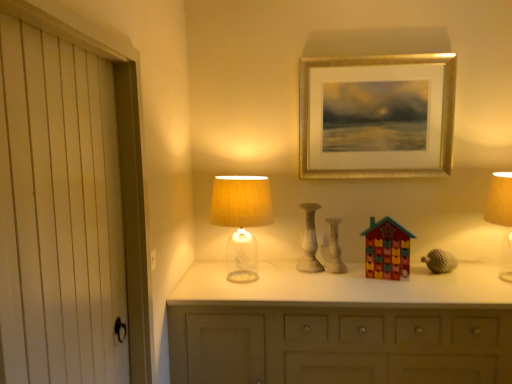
Locate an element on the screen. The width and height of the screenshot is (512, 384). gold metallic picture frame at upper center is located at coordinates (377, 113).

In order to face multicolored plastic advent calendar at center, acting as the first toy starting from the front, should I rotate leftwards or rightwards?

A 17.289 degree turn to the right will do.

Find the location of a particular element. matte ceramic house at center, which ranks as the second toy in right-to-left order is located at coordinates (332, 248).

This screenshot has height=384, width=512. Identify the location of translucent glass lampshade at center, which is the 1th table lamp in left-to-right order. (241, 220).

Describe the element at coordinates (241, 220) in the screenshot. This screenshot has width=512, height=384. I see `translucent glass lampshade at center, which is the 1th table lamp in left-to-right order` at that location.

Locate an element on the screen. white marble candle holder at center is located at coordinates (310, 241).

Locate an element on the screen. The image size is (512, 384). white wood door at left is located at coordinates (120, 165).

From a real-world perspective, which object stands above the other?

From a 3D spatial view, white wood door at left is above.

Image resolution: width=512 pixels, height=384 pixels. In order to click on door on the left of matte yellow fabric lampshade at right, the 1th table lamp positioned from the right in this screenshot , I will do `click(120, 165)`.

How many degrees apart are the facing directions of matte yellow fabric lampshade at right, the second table lamp positioned from the left, and white wood door at left?

The angular difference between matte yellow fabric lampshade at right, the second table lamp positioned from the left, and white wood door at left is 89.7 degrees.

From the image's perspective, between matte yellow fabric lampshade at right, the second table lamp positioned from the left, and white wood door at left, which one is located above?

matte yellow fabric lampshade at right, the second table lamp positioned from the left.

From a real-world perspective, is translucent glass lampshade at center, which is counted as the second table lamp, starting from the right, below multicolored plastic advent calendar at center, acting as the first toy starting from the front?

No, from a real-world perspective, translucent glass lampshade at center, which is counted as the second table lamp, starting from the right, is not under multicolored plastic advent calendar at center, acting as the first toy starting from the front.

Consider the image. Measure the distance from translucent glass lampshade at center, which is counted as the second table lamp, starting from the right, to multicolored plastic advent calendar at center, acting as the first toy starting from the front.

27.79 inches.

In the scene shown: Between translucent glass lampshade at center, which is the 1th table lamp in left-to-right order, and multicolored plastic advent calendar at center, positioned as the 2th toy in left-to-right order, which one has more height?

translucent glass lampshade at center, which is the 1th table lamp in left-to-right order.

Could you tell me if translucent glass lampshade at center, which is counted as the second table lamp, starting from the right, is facing multicolored plastic advent calendar at center, which is counted as the first toy, starting from the right?

No, translucent glass lampshade at center, which is counted as the second table lamp, starting from the right, is not facing towards multicolored plastic advent calendar at center, which is counted as the first toy, starting from the right.

Could gold metallic picture frame at upper center be considered to be inside matte ceramic house at center, placed as the 1th toy when sorted from left to right?

No, gold metallic picture frame at upper center is located outside of matte ceramic house at center, placed as the 1th toy when sorted from left to right.

Considering the sizes of matte ceramic house at center, which ranks as the second toy in right-to-left order, and gold metallic picture frame at upper center in the image, is matte ceramic house at center, which ranks as the second toy in right-to-left order, taller or shorter than gold metallic picture frame at upper center?

In the image, matte ceramic house at center, which ranks as the second toy in right-to-left order, appears to be shorter than gold metallic picture frame at upper center.

Would you say white wood door at left is inside or outside matte gray acorn at right?

white wood door at left is spatially situated outside matte gray acorn at right.

Which is less distant, (122, 92) or (438, 259)?

Clearly, point (122, 92) is closer to the camera than point (438, 259).

In the scene shown: Is the surface of white wood door at left in direct contact with matte gray acorn at right?

No, white wood door at left is not touching matte gray acorn at right.

Does white wood door at left have a lesser height compared to matte gray acorn at right?

Incorrect, the height of white wood door at left does not fall short of that of matte gray acorn at right.

From their relative heights in the image, would you say translucent glass lampshade at center, which is the 1th table lamp in left-to-right order, is taller or shorter than white marble candle holder at center?

In the image, translucent glass lampshade at center, which is the 1th table lamp in left-to-right order, appears to be taller than white marble candle holder at center.

Is translucent glass lampshade at center, which is counted as the second table lamp, starting from the right, looking in the opposite direction of white marble candle holder at center?

That's not correct — translucent glass lampshade at center, which is counted as the second table lamp, starting from the right, is not looking away from white marble candle holder at center.

Between translucent glass lampshade at center, which is the 1th table lamp in left-to-right order, and white marble candle holder at center, which one has smaller width?

white marble candle holder at center.

In terms of size, does translucent glass lampshade at center, which is the 1th table lamp in left-to-right order, appear bigger or smaller than white marble candle holder at center?

Clearly, translucent glass lampshade at center, which is the 1th table lamp in left-to-right order, is larger in size than white marble candle holder at center.

Is translucent glass lampshade at center, which is the 1th table lamp in left-to-right order, far away from white wood door at left?

translucent glass lampshade at center, which is the 1th table lamp in left-to-right order, is actually quite close to white wood door at left.

Who is smaller, translucent glass lampshade at center, which is the 1th table lamp in left-to-right order, or white wood door at left?

translucent glass lampshade at center, which is the 1th table lamp in left-to-right order.

Is translucent glass lampshade at center, which is the 1th table lamp in left-to-right order, further to the viewer compared to white wood door at left?

Yes.

Measure the distance from translucent glass lampshade at center, which is the 1th table lamp in left-to-right order, to white wood door at left.

They are 25.38 inches apart.

Is point (451, 266) positioned before point (366, 276)?

No.

Measure the distance from matte gray acorn at right to multicolored plastic advent calendar at center, acting as the first toy starting from the front.

matte gray acorn at right and multicolored plastic advent calendar at center, acting as the first toy starting from the front, are 12.43 inches apart from each other.

Based on the photo, which object is positioned more to the left, matte gray acorn at right or multicolored plastic advent calendar at center, acting as the first toy starting from the front?

multicolored plastic advent calendar at center, acting as the first toy starting from the front.

Between matte gray acorn at right and multicolored plastic advent calendar at center, acting as the first toy starting from the front, which one has more height?

Standing taller between the two is multicolored plastic advent calendar at center, acting as the first toy starting from the front.

You are a GUI agent. You are given a task and a screenshot of the screen. Output one action in this format:
    pyautogui.click(x=<x>, y=<y>)
    Task: Click on the door below the matte yellow fabric lampshade at right, the second table lamp positioned from the left (from the image's perspective)
    
    Given the screenshot: What is the action you would take?
    pyautogui.click(x=120, y=165)

Identify the location of the 1st table lamp in front of the multicolored plastic advent calendar at center, positioned as the 2th toy in left-to-right order, starting your count from the anchor. The height and width of the screenshot is (384, 512). (241, 220).

Based on their spatial positions, is multicolored plastic advent calendar at center, acting as the first toy starting from the front, or matte ceramic house at center, which ranks as the second toy in right-to-left order, closer to white marble candle holder at center?

matte ceramic house at center, which ranks as the second toy in right-to-left order, lies closer to white marble candle holder at center than the other object.

Which object lies nearer to the anchor point matte gray acorn at right, white wood door at left or multicolored plastic advent calendar at center, acting as the first toy starting from the front?

multicolored plastic advent calendar at center, acting as the first toy starting from the front, is closer to matte gray acorn at right.

From the image, which object appears to be farther from matte gray acorn at right, multicolored plastic advent calendar at center, which ranks as the 2th toy in back-to-front order, or gold metallic picture frame at upper center?

gold metallic picture frame at upper center is positioned further to the anchor matte gray acorn at right.

Considering their positions, is matte ceramic house at center, placed as the 1th toy when sorted from left to right, positioned further to matte gray acorn at right than matte yellow fabric lampshade at right, the second table lamp positioned from the left?

matte ceramic house at center, placed as the 1th toy when sorted from left to right, is positioned further to the anchor matte gray acorn at right.

From the picture: Based on their spatial positions, is white marble candle holder at center or white wood door at left closer to matte gray acorn at right?

white marble candle holder at center lies closer to matte gray acorn at right than the other object.

Considering their positions, is matte ceramic house at center, which ranks as the second toy in right-to-left order, positioned closer to white wood door at left than gold metallic picture frame at upper center?

The object closer to white wood door at left is matte ceramic house at center, which ranks as the second toy in right-to-left order.

Based on their spatial positions, is matte yellow fabric lampshade at right, the 1th table lamp positioned from the right, or gold metallic picture frame at upper center closer to translucent glass lampshade at center, which is counted as the second table lamp, starting from the right?

Based on the image, gold metallic picture frame at upper center appears to be nearer to translucent glass lampshade at center, which is counted as the second table lamp, starting from the right.

When comparing their distances from matte gray acorn at right, does matte ceramic house at center, which ranks as the second toy in right-to-left order, or gold metallic picture frame at upper center seem closer?

Among the two, matte ceramic house at center, which ranks as the second toy in right-to-left order, is located nearer to matte gray acorn at right.

Locate an element on the screen. Image resolution: width=512 pixels, height=384 pixels. miniature situated between matte ceramic house at center, the 2th toy when ordered from front to back, and matte yellow fabric lampshade at right, the second table lamp positioned from the left, from left to right is located at coordinates (440, 261).

This screenshot has height=384, width=512. What are the coordinates of `miniature between white wood door at left and gold metallic picture frame at upper center in the front-back direction` in the screenshot? It's located at (440, 261).

The image size is (512, 384). In order to click on candle holder between white wood door at left and matte yellow fabric lampshade at right, the second table lamp positioned from the left, from left to right in this screenshot , I will do `click(310, 241)`.

You are a GUI agent. You are given a task and a screenshot of the screen. Output one action in this format:
    pyautogui.click(x=<x>, y=<y>)
    Task: Click on the picture frame situated between white wood door at left and matte yellow fabric lampshade at right, the second table lamp positioned from the left, from left to right
    
    Given the screenshot: What is the action you would take?
    pyautogui.click(x=377, y=113)